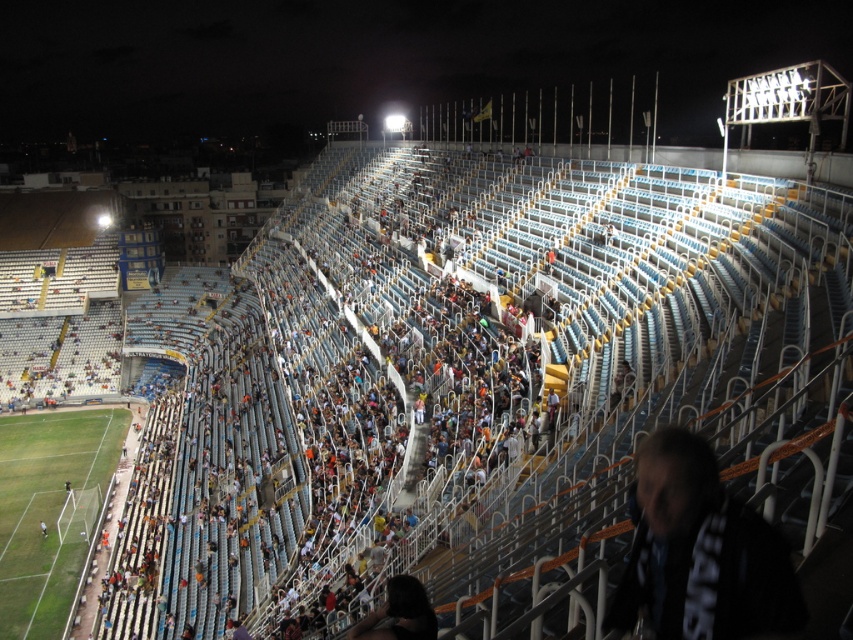
You are a photographer at the stadium and want to capture a photo that includes both the green grass football field at lower left and the dark hair at lower center. Based on their positions, which object should appear lower in the photo?

The green grass football field at lower left is positioned below the dark hair at lower center, so in the photo, the green grass football field at lower left will appear lower than the dark hair at lower center.

Looking at this image, you are a photographer at the stadium and want to capture a photo of the green grass football field at lower left without any obstructions. Is the dark hair at lower center blocking your view of the field?

The dark hair at lower center is behind the green grass football field at lower left, so it does not obstruct the view of the field. You can take the photo without any issues.

You are a photographer standing at the edge of the field. You want to take a photo of the dark fabric jacket at lower right and dark hair at lower center without any obstruction. Which object should you focus on first to ensure they are both in the frame?

You should focus on the dark hair at lower center first because it is closer to you than the dark fabric jacket at lower right, so capturing it first ensures both will be in the frame.